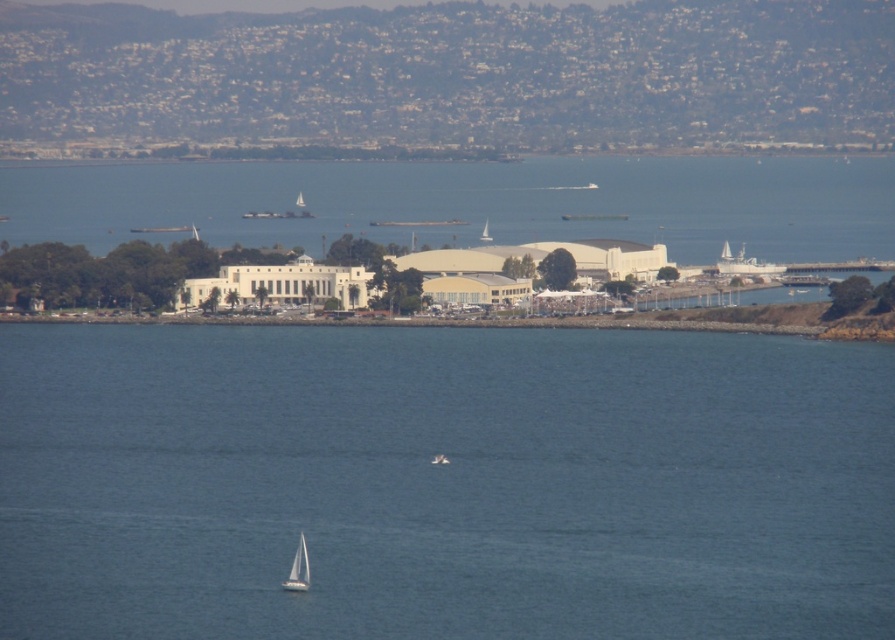
Question: Which point is farther to the camera?

Choices:
 (A) white matte sailboat at lower center
 (B) white matte sailboat at center

Answer: (A)

Question: Does blue water at center come behind white matte sailboat at lower center?

Choices:
 (A) no
 (B) yes

Answer: (A)

Question: Does white matte sailboat at lower center appear under white matte sailboat at center?

Choices:
 (A) yes
 (B) no

Answer: (A)

Question: Which of the following is the closest to the observer?

Choices:
 (A) white matte sailboat at lower center
 (B) white matte sailboat at center

Answer: (B)

Question: Among these objects, which one is nearest to the camera?

Choices:
 (A) blue water at center
 (B) white matte sailboat at center

Answer: (A)

Question: Does blue water at center have a greater width compared to white matte sailboat at lower center?

Choices:
 (A) yes
 (B) no

Answer: (A)